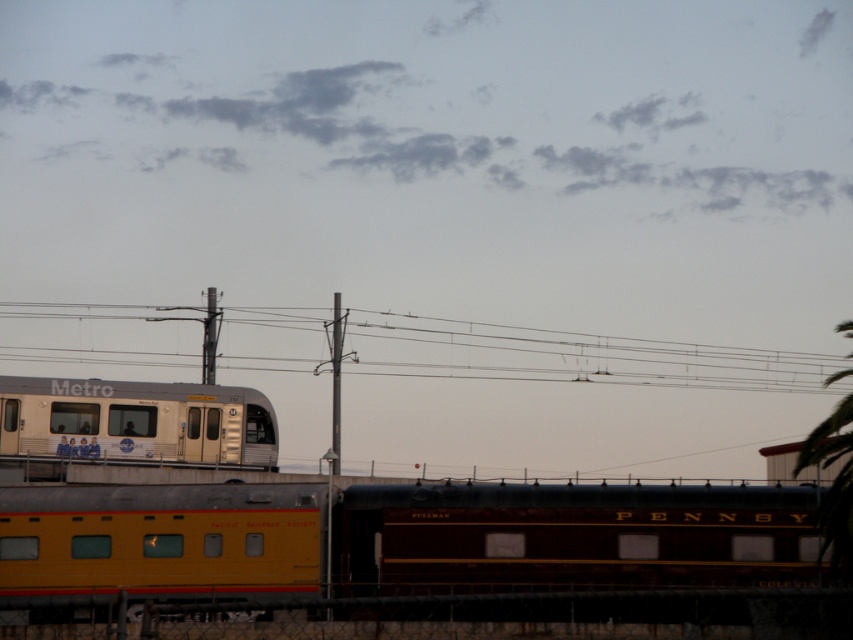
Is yellow polished wood train at lower left to the right of metallic wires at upper center from the viewer's perspective?

Correct, you'll find yellow polished wood train at lower left to the right of metallic wires at upper center.

Is point (312, 492) closer to viewer compared to point (183, 362)?

Yes, point (312, 492) is closer to viewer.

Where is `yellow polished wood train at lower left`? The height and width of the screenshot is (640, 853). yellow polished wood train at lower left is located at coordinates (407, 545).

Which of these two, yellow polished wood train at lower left or green leafy tree at right, stands taller?

With more height is green leafy tree at right.

Is yellow polished wood train at lower left behind green leafy tree at right?

No.

Does point (274, 570) come behind point (850, 337)?

Yes, it is.

Where is `yellow polished wood train at lower left`? This screenshot has width=853, height=640. yellow polished wood train at lower left is located at coordinates (407, 545).

Is metallic wires at upper center behind green leafy tree at right?

Yes, it is.

Who is lower down, metallic wires at upper center or green leafy tree at right?

green leafy tree at right is below.

Who is more forward, (656, 352) or (839, 404)?

Point (839, 404) is in front.

This screenshot has height=640, width=853. I want to click on metallic wires at upper center, so click(x=573, y=355).